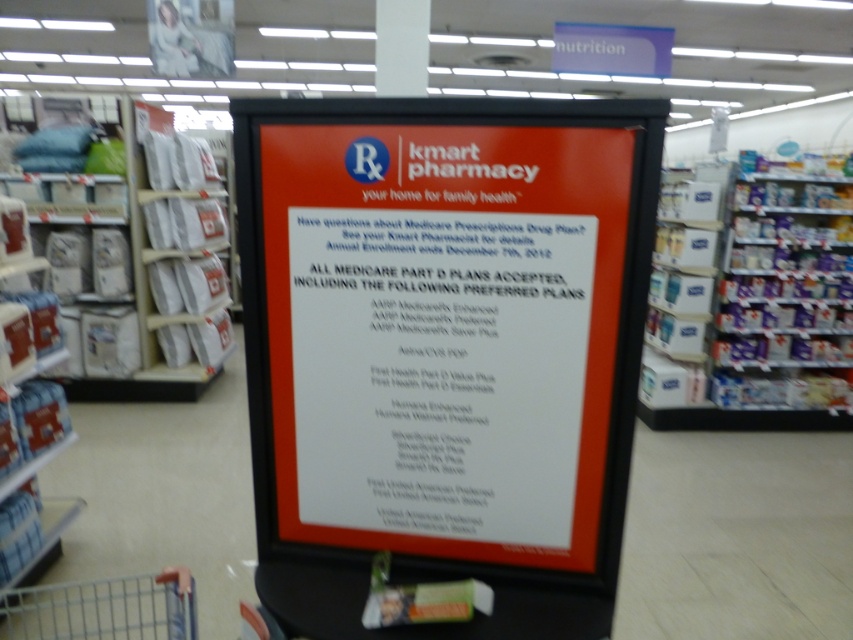
Question: Is matte plastic sign at center above metallic silver shopping cart at lower left?

Choices:
 (A) no
 (B) yes

Answer: (B)

Question: Does matte plastic sign at center appear on the left side of metallic silver shopping cart at lower left?

Choices:
 (A) yes
 (B) no

Answer: (B)

Question: Does matte plastic sign at center have a smaller size compared to metallic silver shopping cart at lower left?

Choices:
 (A) yes
 (B) no

Answer: (B)

Question: Among these objects, which one is farthest from the camera?

Choices:
 (A) matte plastic sign at center
 (B) metallic silver shopping cart at lower left

Answer: (B)